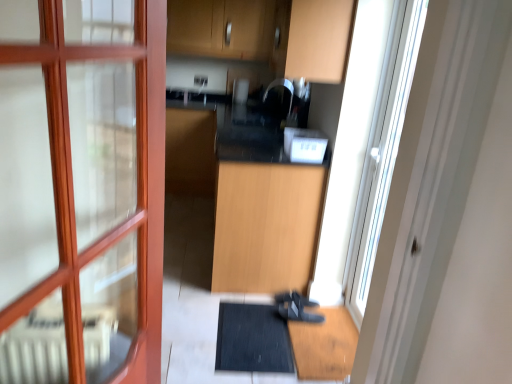
Where is `free spot above black rubber bath mat at lower center (from a real-world perspective)`? Image resolution: width=512 pixels, height=384 pixels. free spot above black rubber bath mat at lower center (from a real-world perspective) is located at coordinates (258, 329).